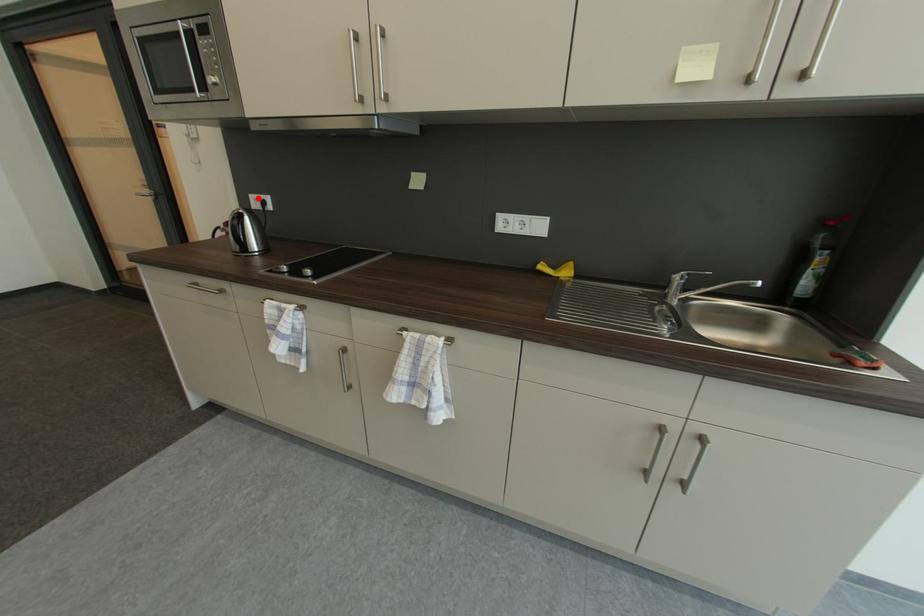
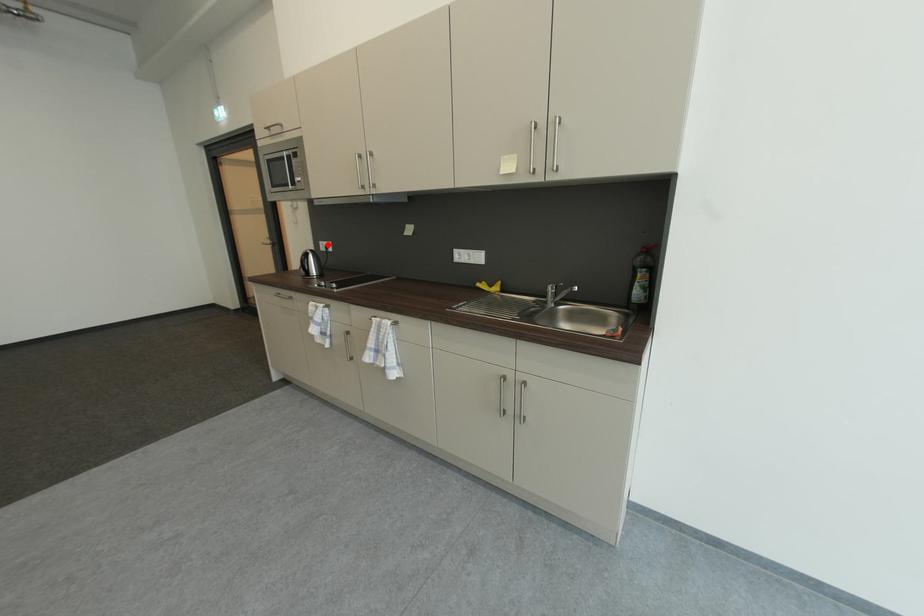
I am providing you with two images of the same scene from different viewpoints. A red point is marked on the first image and another point is marked on the second image. Is the marked point in image1 the same physical position as the marked point in image2?

Yes